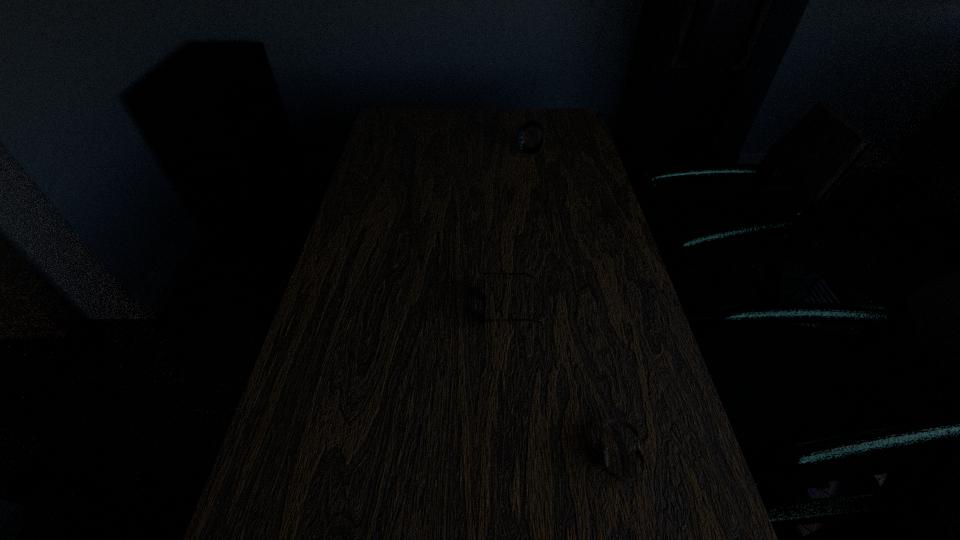
Identify the location of empty space that is in between the nearer watch and the second farthest object. (564, 381).

At what (x,y) coordinates should I click in order to perform the action: click on vacant area between the nearer watch and the spectacles. Please return your answer as a coordinate pair (x, y). The image size is (960, 540). Looking at the image, I should click on (564, 381).

The image size is (960, 540). Identify the location of vacant region between the second nearest object and the taller watch. (520, 231).

Locate an element on the screen. The height and width of the screenshot is (540, 960). vacant point located between the second farthest object and the nearer watch is located at coordinates (564, 381).

The height and width of the screenshot is (540, 960). In order to click on free space between the shorter watch and the second nearest object in this screenshot , I will do `click(564, 381)`.

At what (x,y) coordinates should I click in order to perform the action: click on free space that is in between the nearer watch and the second farthest object. Please return your answer as a coordinate pair (x, y). This screenshot has height=540, width=960. Looking at the image, I should click on (564, 381).

Identify the location of vacant area between the second farthest object and the shorter watch. The height and width of the screenshot is (540, 960). click(x=564, y=381).

Where is `free space between the shorter watch and the farthest object`? The width and height of the screenshot is (960, 540). free space between the shorter watch and the farthest object is located at coordinates (574, 303).

Locate which object ranks in proximity to the nearer watch. Please provide its 2D coordinates. Your answer should be formatted as a tuple, i.e. [(x, y)], where the tuple contains the x and y coordinates of a point satisfying the conditions above.

[(484, 295)]

The image size is (960, 540). What are the coordinates of `object that is the second closest to the nearer watch` in the screenshot? It's located at (520, 132).